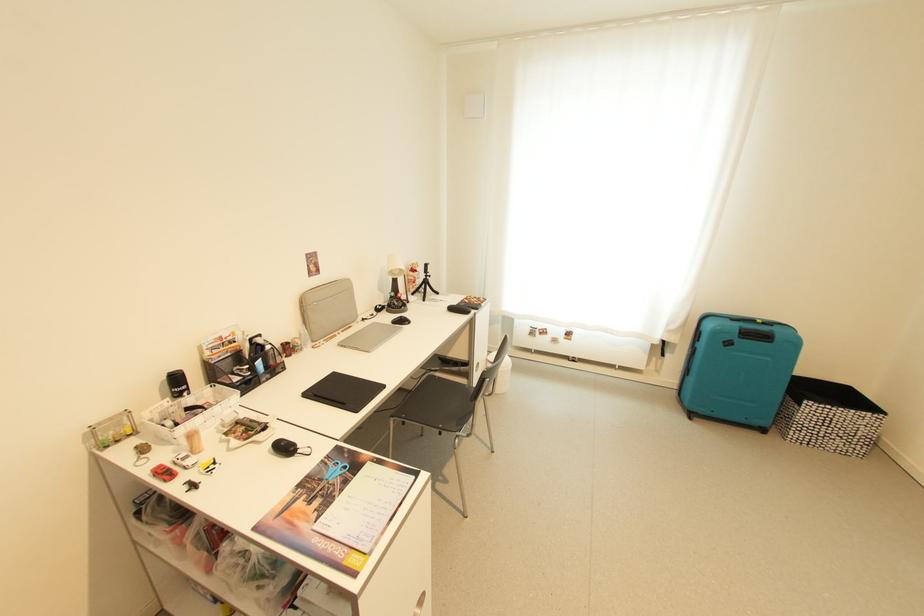
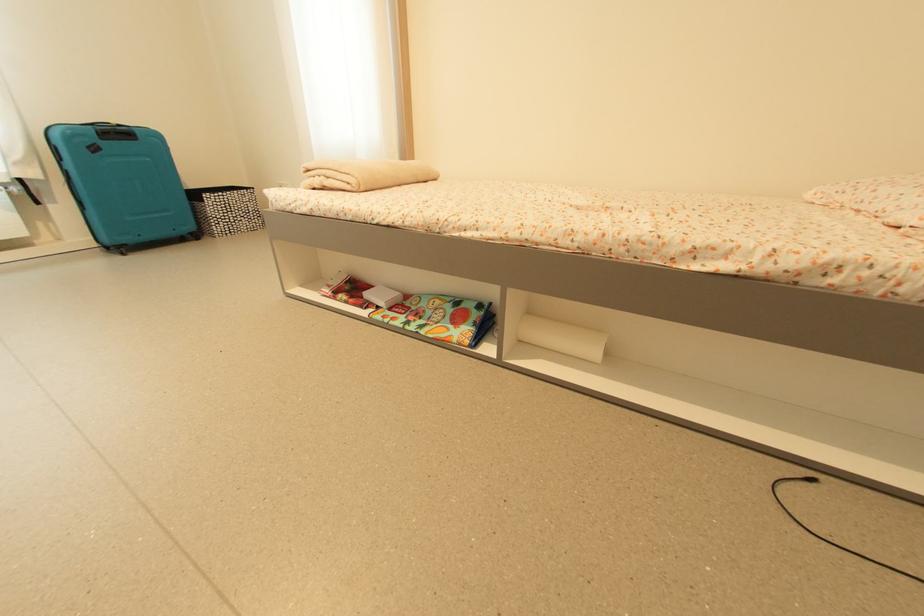
In the second image, find the point that corresponds to the point at 804,418 in the first image.

(213, 212)